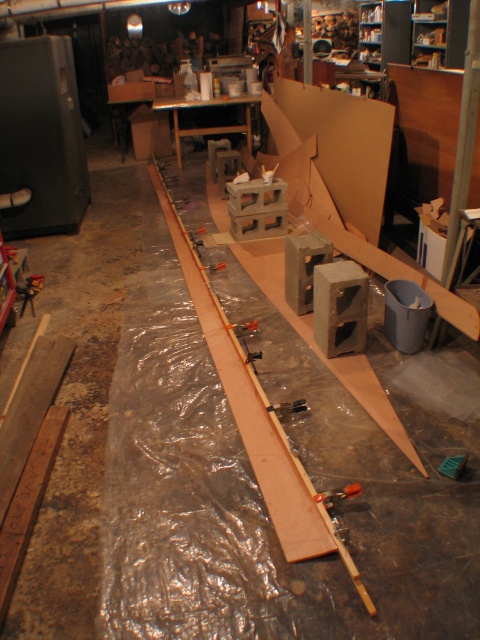
Question: Does matte gray concrete blocks at center have a lesser width compared to metallic silver clamp at center?

Choices:
 (A) yes
 (B) no

Answer: (B)

Question: Is matte gray concrete blocks at center bigger than metallic silver clamp at center?

Choices:
 (A) yes
 (B) no

Answer: (A)

Question: Which is farther from the metallic silver clamp at center?

Choices:
 (A) metallic silver screwdriver at center
 (B) matte gray concrete blocks at center

Answer: (B)

Question: Which point is farther to the camera?

Choices:
 (A) (285, 401)
 (B) (354, 492)
 (C) (240, 131)

Answer: (C)

Question: Which object is positioned closest to the metallic silver screwdriver at center?

Choices:
 (A) matte gray concrete blocks at center
 (B) metallic silver clamp at center

Answer: (B)

Question: Is matte gray concrete blocks at center positioned at the back of metallic silver clamp at center?

Choices:
 (A) no
 (B) yes

Answer: (B)